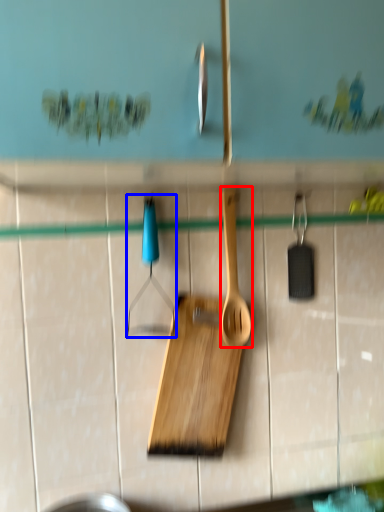
Question: Which object appears closest to the camera in this image, spatula (highlighted by a red box) or hanger (highlighted by a blue box)?

Choices:
 (A) spatula
 (B) hanger

Answer: (B)